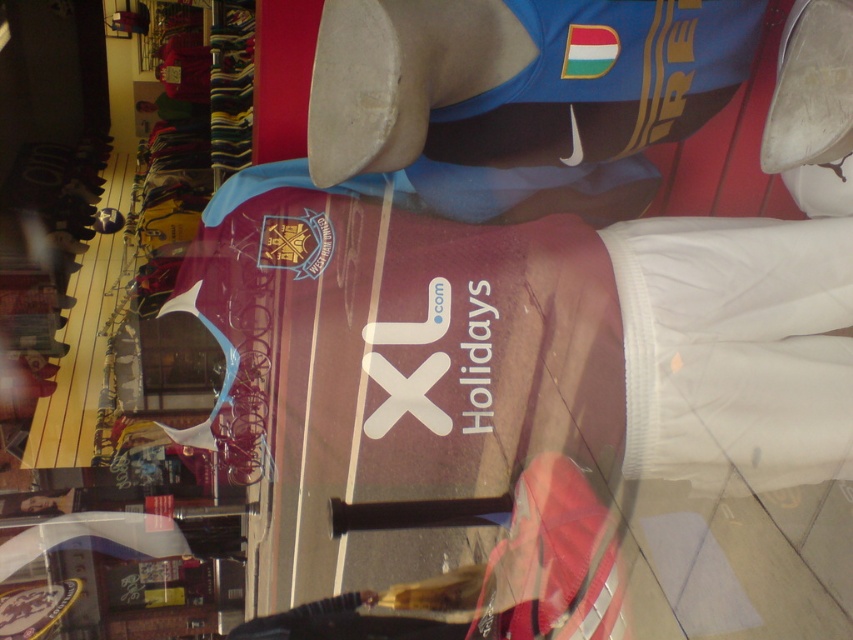
Can you confirm if white matte shoe at center is bigger than white matte shoe at upper center?

No.

Does point (386, 10) come behind point (821, 145)?

No, it is not.

Locate an element on the screen. This screenshot has height=640, width=853. white matte shoe at center is located at coordinates (370, 86).